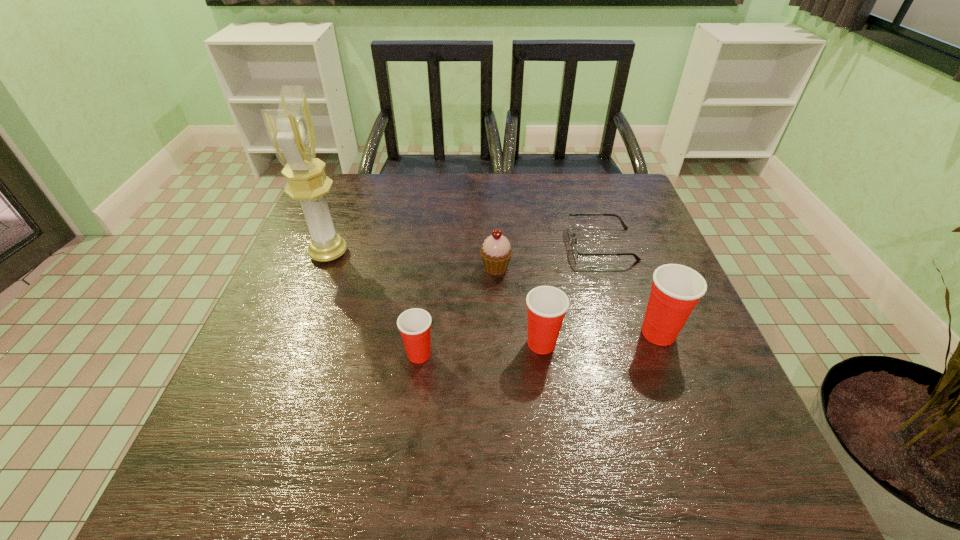
What are the coordinates of `the fifth object from right to left` in the screenshot? It's located at (414, 325).

Locate an element on the screen. The height and width of the screenshot is (540, 960). the leftmost Dixie cup is located at coordinates (414, 325).

The image size is (960, 540). What are the coordinates of `the second Dixie cup from left to right` in the screenshot? It's located at (546, 305).

Identify the location of the second tallest Dixie cup. (546, 305).

The image size is (960, 540). Find the location of `the rightmost Dixie cup`. the rightmost Dixie cup is located at coordinates (676, 289).

Locate an element on the screen. The width and height of the screenshot is (960, 540). the second tallest object is located at coordinates (676, 289).

This screenshot has width=960, height=540. What are the coordinates of `the tallest object` in the screenshot? It's located at (291, 130).

Locate an element on the screen. The image size is (960, 540). award is located at coordinates (291, 130).

Where is `the third object from left to right`? the third object from left to right is located at coordinates (496, 252).

At what (x,y) coordinates should I click in order to perform the action: click on spectacles. Please return your answer as a coordinate pair (x, y). This screenshot has height=540, width=960. Looking at the image, I should click on (575, 250).